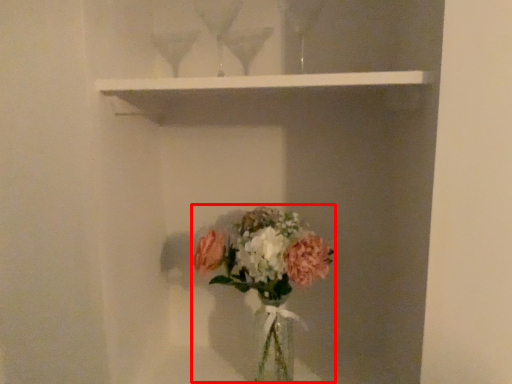
Question: Observing the image, what is the correct spatial positioning of floral arrangement (annotated by the red box) in reference to window sill?

Choices:
 (A) right
 (B) left

Answer: (A)